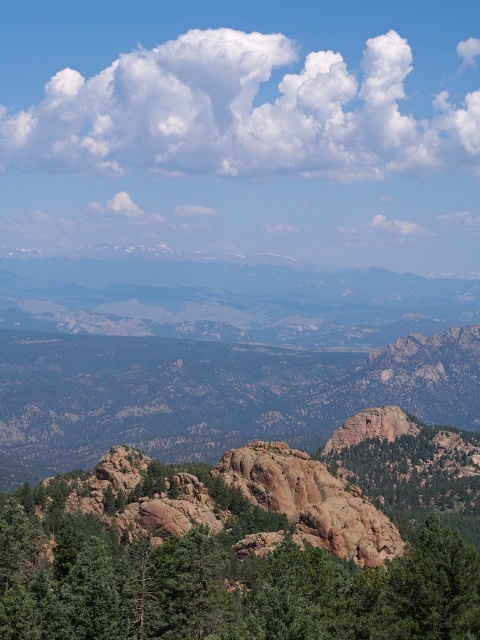
You are an airplane pilot flying over the mountainous landscape. You notice the white fluffy cloud at upper center and the rocky mountain range at center. Which object is positioned more to the east if the sun is setting in the west?

The white fluffy cloud at upper center is positioned more to the east because it is to the right of the rocky mountain range at center, and since the sun is setting in the west, the right side of the image corresponds to the east direction.

You are a hiker standing at the base of the mountain. You notice a white fluffy cloud at upper center and a green textured rock at center. Which object is positioned higher in the sky?

The white fluffy cloud at upper center is positioned higher in the sky than the green textured rock at center because it is located above it.